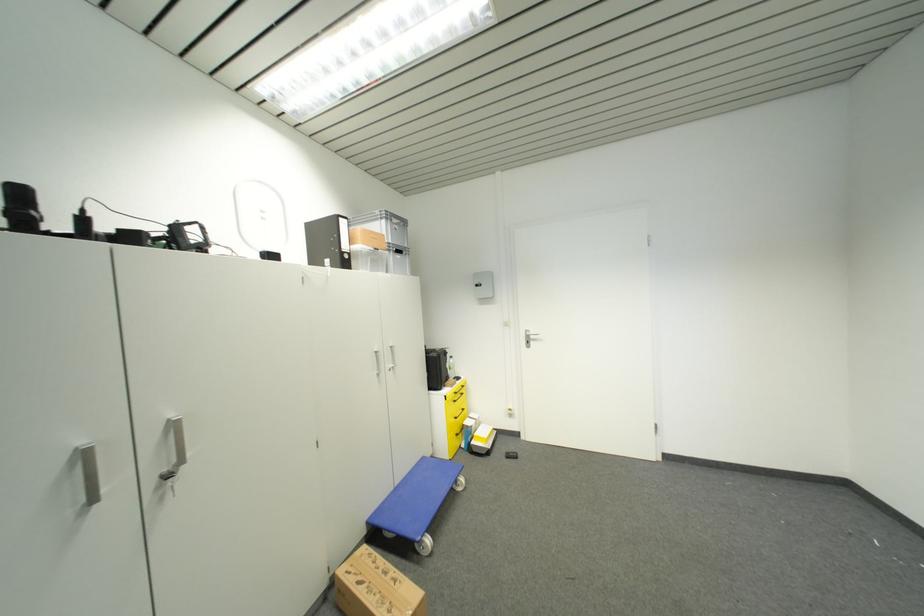
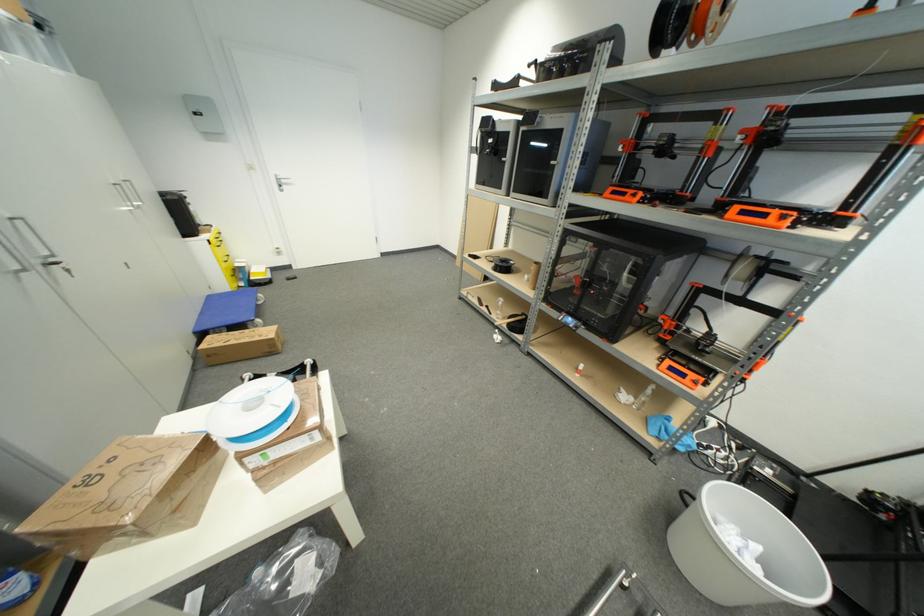
Locate, in the second image, the point that corresponds to the point at 428,461 in the first image.

(213, 299)